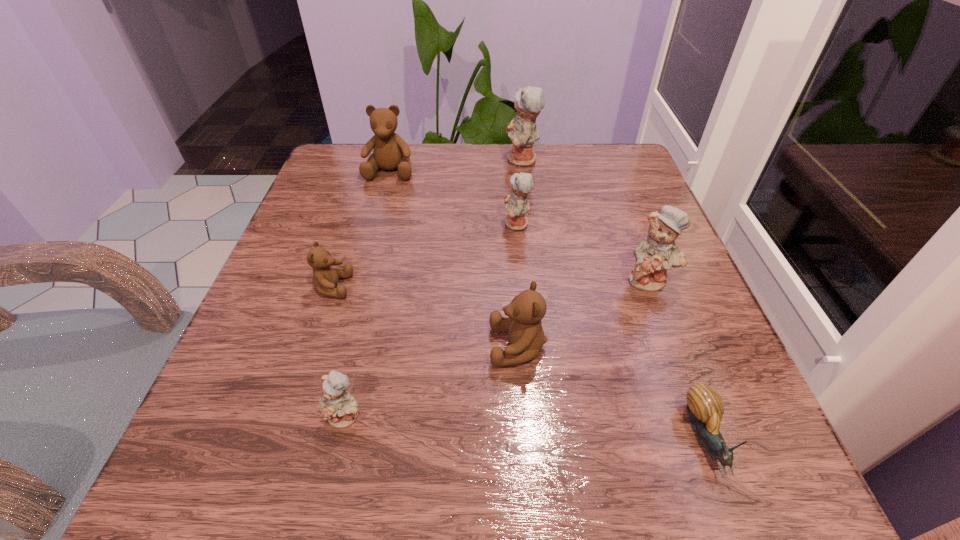
This screenshot has height=540, width=960. In order to click on the tallest object in this screenshot , I will do `click(522, 131)`.

Find the location of a particular element. The image size is (960, 540). the tallest teddy bear is located at coordinates (522, 131).

Identify the location of the farthest brown teddy bear. This screenshot has width=960, height=540. (391, 152).

Identify the location of the third farthest blue teddy bear. (659, 252).

Locate an element on the screen. the rightmost blue teddy bear is located at coordinates (659, 252).

This screenshot has width=960, height=540. In order to click on the second farthest blue teddy bear in this screenshot , I will do `click(517, 204)`.

Locate an element on the screen. This screenshot has height=540, width=960. the third farthest object is located at coordinates (517, 204).

Find the location of a particular element. This screenshot has width=960, height=540. the second smallest brown teddy bear is located at coordinates (526, 337).

Identify the location of the second nearest teddy bear. The image size is (960, 540). (526, 337).

I want to click on the nearest teddy bear, so click(339, 407).